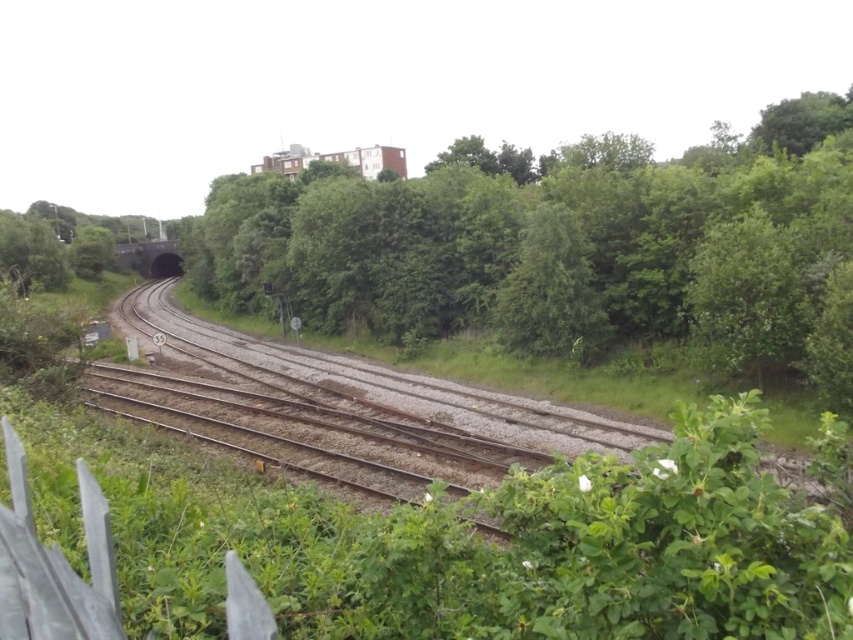
Between point (646, 173) and point (355, 452), which one is positioned behind?

Point (646, 173)

Can you confirm if green leafy tree at center is shorter than brown gravel track at center?

No.

Does point (572, 173) lie behind point (459, 436)?

That is True.

Identify the location of green leafy tree at center. This screenshot has height=640, width=853. (569, 250).